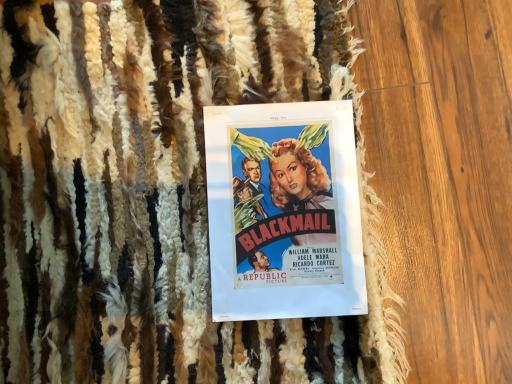
Find the location of a particular element. free space that is to the left of vivid paper poster at center is located at coordinates (140, 196).